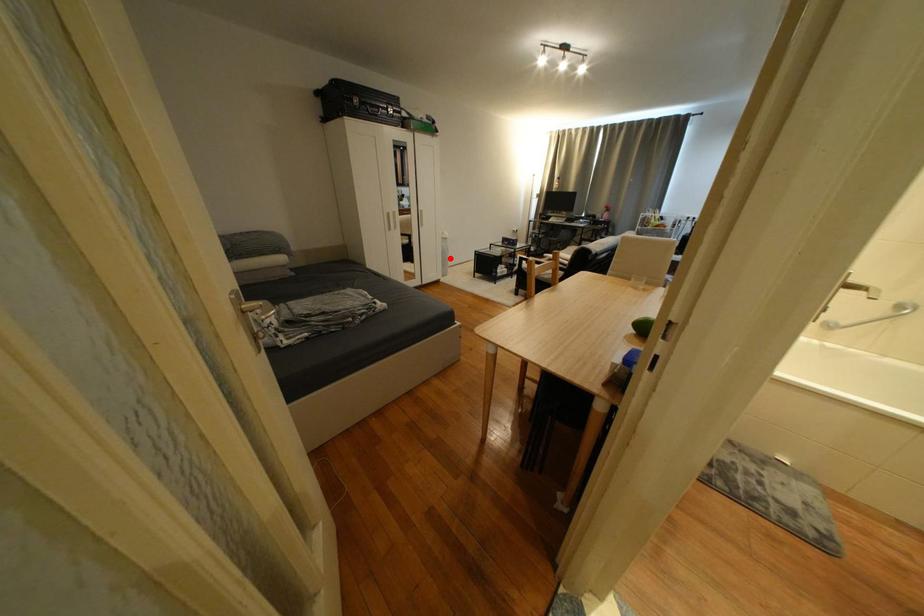
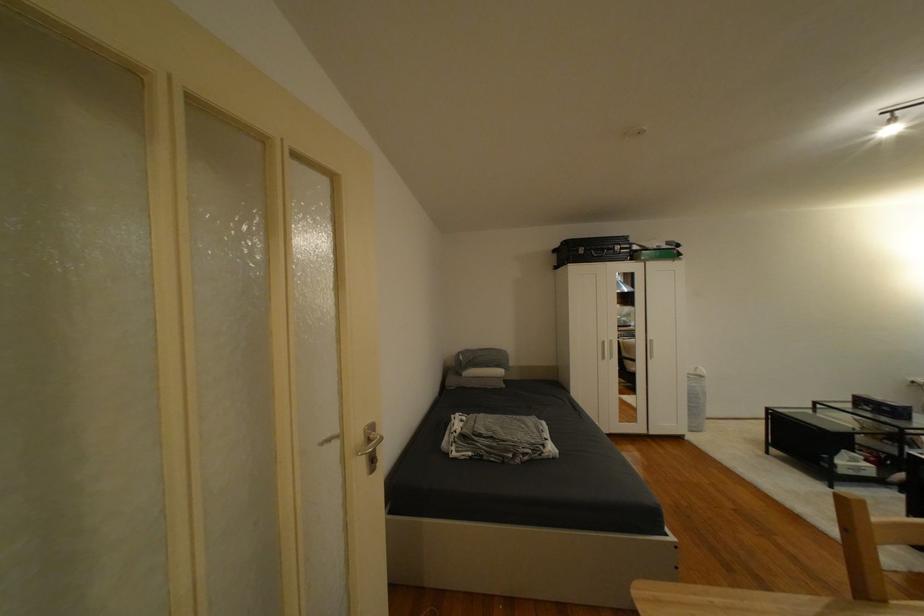
Find the pixel in the second image that matches the highlighted location in the first image.

(698, 403)